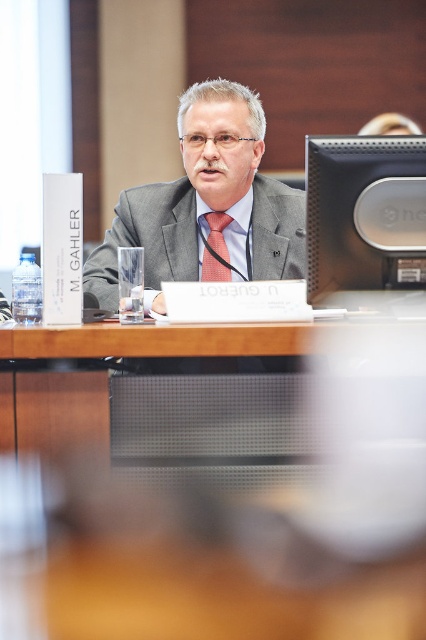
You are an attendee at this conference. You need to present your slides on the sleek black monitor at upper center. Where exactly should you position yourself to operate the monitor effectively?

The sleek black monitor at upper center is located at point 0.334 on the x axis and 0.857 on the y axis. To operate it effectively, position yourself near the monitor at these coordinates.

You are standing at the conference table and notice two points marked in the room. The first point is at coordinate point (356, 209) and the second is at coordinate point (213, 232). If you were facing the front of the room, which point would be closer to you?

Point (356, 209) is in front of point (213, 232), so if you are facing the front of the room, point (356, 209) would be closer to you.

You are standing at the table in the conference room. There are two points marked on the floor. One is at coordinate point (195, 198) and the other at point (227, 280). If you face the front of the room, which point is located behind the other?

Point (195, 198) is behind point (227, 280) when facing the front of the room.